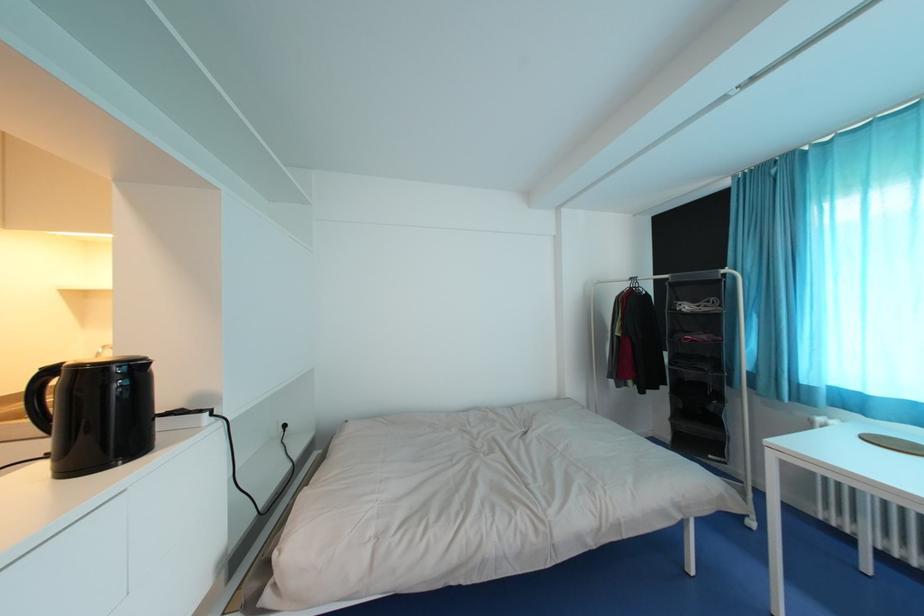
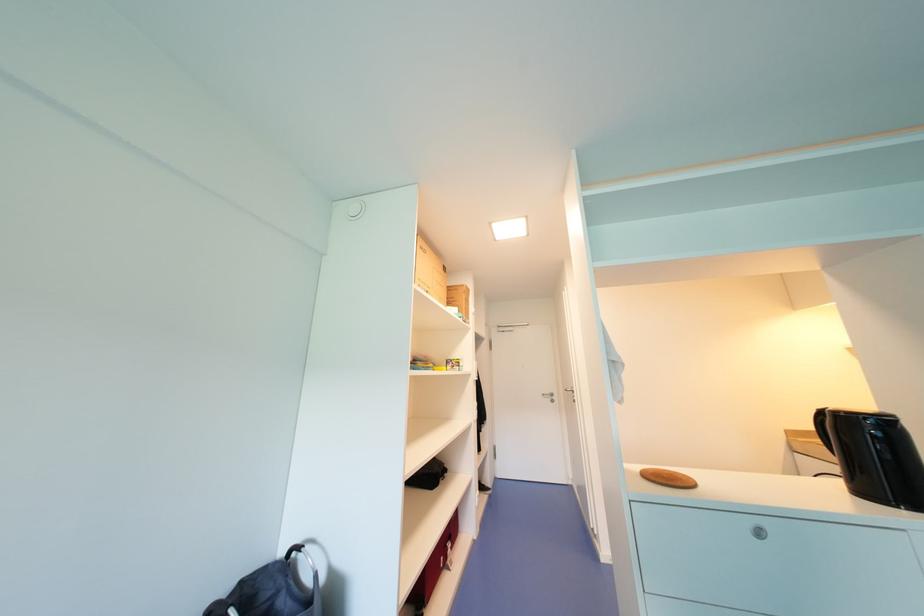
Question: Based on the continuous images, in which direction is the camera rotating? Reply with the corresponding letter.

Choices:
 (A) Left
 (B) Right
 (C) Up
 (D) Down

Answer: (A)